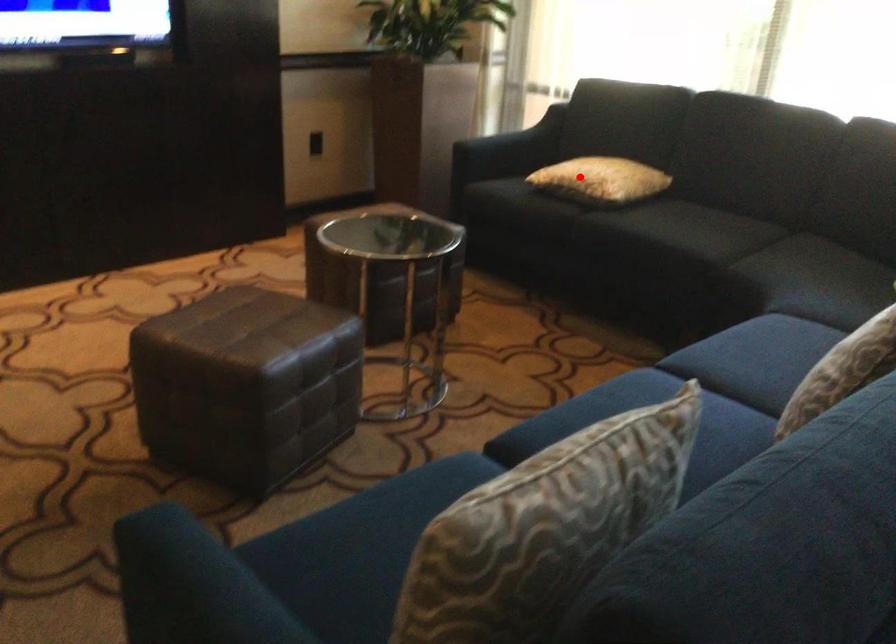
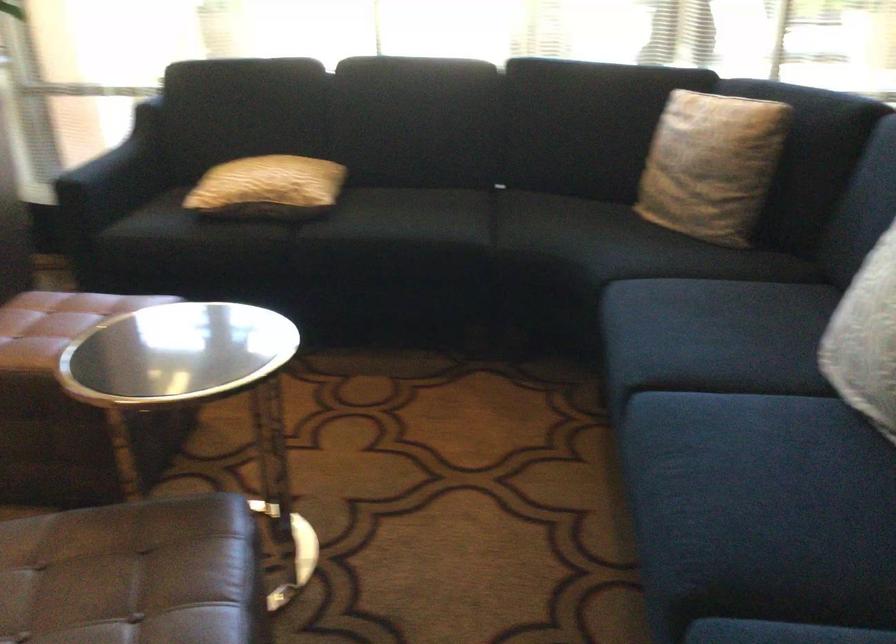
The point at the highlighted location is marked in the first image. Where is the corresponding point in the second image?

(268, 187)